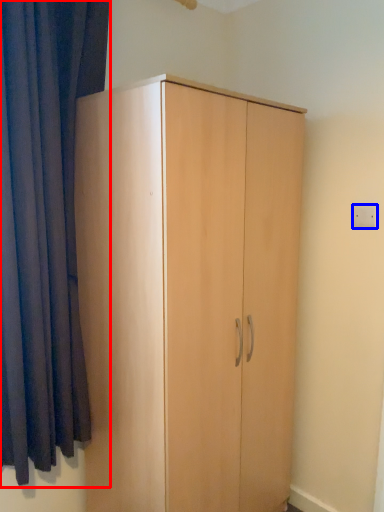
Question: Which object is closer to the camera taking this photo, curtain (highlighted by a red box) or electric outlet (highlighted by a blue box)?

Choices:
 (A) curtain
 (B) electric outlet

Answer: (A)